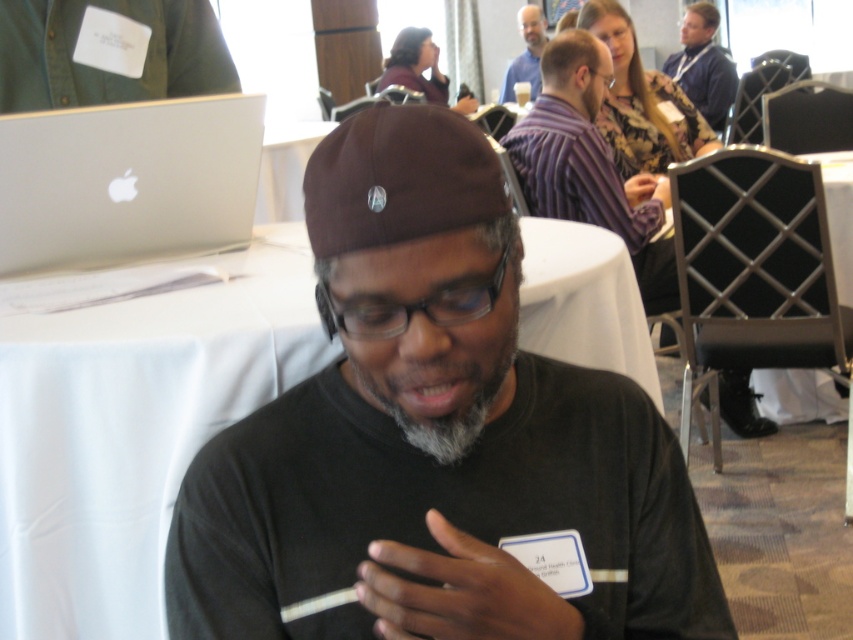
You are a photographer trying to capture a candid shot of the gray matte beard at center without including the matte blue shirt at upper right in the frame. Is this possible given their positions?

The matte blue shirt at upper right is positioned over the gray matte beard at center, so it would block the view. Therefore, it is not possible to capture the gray matte beard at center without including the matte blue shirt at upper right in the frame.

You are organizing a photo shoot and need to place a small accessory next to both the matte blue shirt at upper right and the gray matte beard at center. Based on their sizes, which object requires a larger accessory to maintain visual balance?

The matte blue shirt at upper right requires a larger accessory because it is wider than the gray matte beard at center.